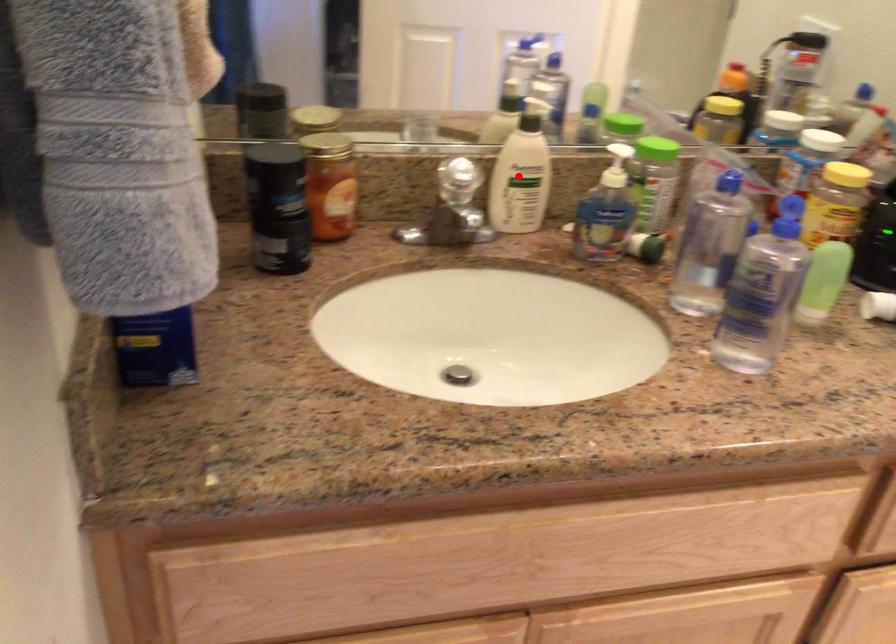
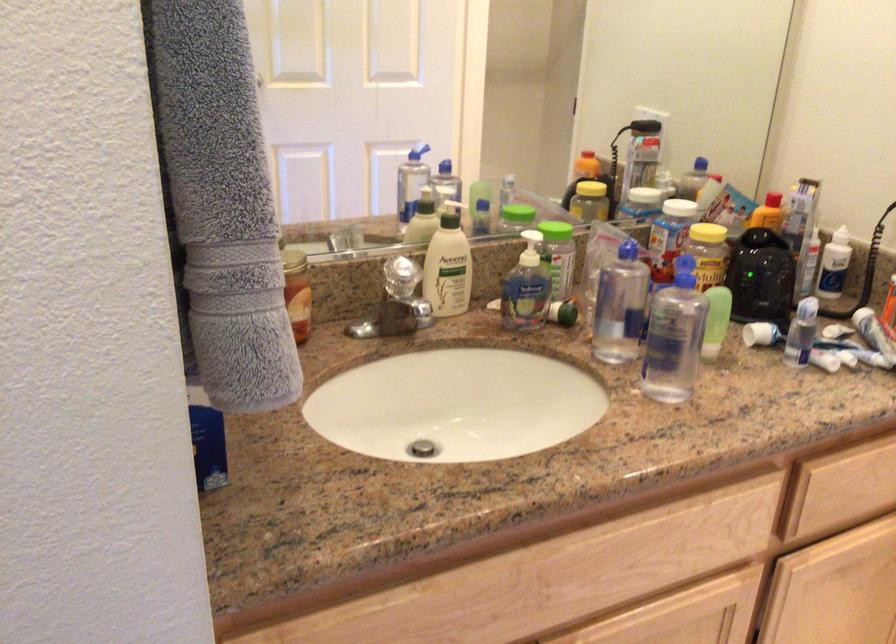
Question: I am providing you with two images of the same scene from different viewpoints. A red point is shown in image1. For the corresponding object point in image2, is it positioned nearer or farther from the camera?

Choices:
 (A) Nearer
 (B) Farther

Answer: (B)